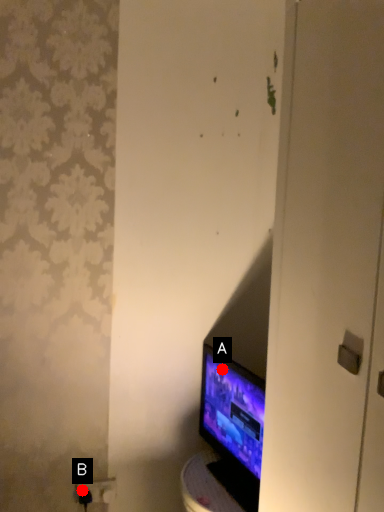
Question: Two points are circled on the image, labeled by A and B beside each circle. Which point is farther to the camera?

Choices:
 (A) A is further
 (B) B is further

Answer: (A)